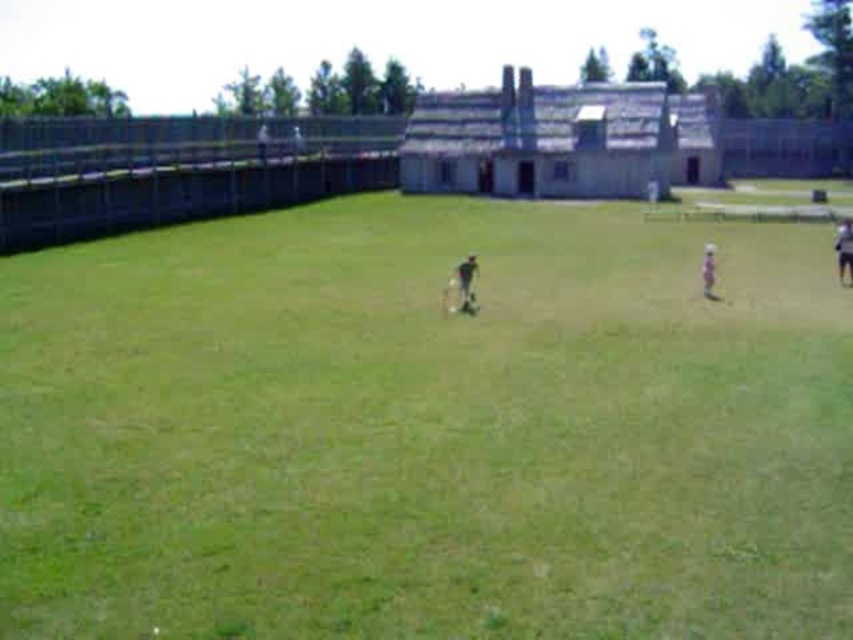
Question: Which point is farther to the camera?

Choices:
 (A) (262, 154)
 (B) (704, 284)

Answer: (A)

Question: Which of the following is the farthest from the observer?

Choices:
 (A) dark blue fabric person at right
 (B) dark gray fabric person at center

Answer: (A)

Question: Is green grass at center closer to the viewer compared to dark blue fabric person at right?

Choices:
 (A) no
 (B) yes

Answer: (B)

Question: Is dark blue fabric person at right to the left of light brown fabric person at center from the viewer's perspective?

Choices:
 (A) no
 (B) yes

Answer: (A)

Question: Is dark gray fabric person at center below light brown fabric person at center?

Choices:
 (A) no
 (B) yes

Answer: (B)

Question: Which point is closer to the camera?

Choices:
 (A) dark blue fabric person at right
 (B) green grass at center
 (C) dark gray uniform at center
 (D) light brown fabric person at center

Answer: (B)